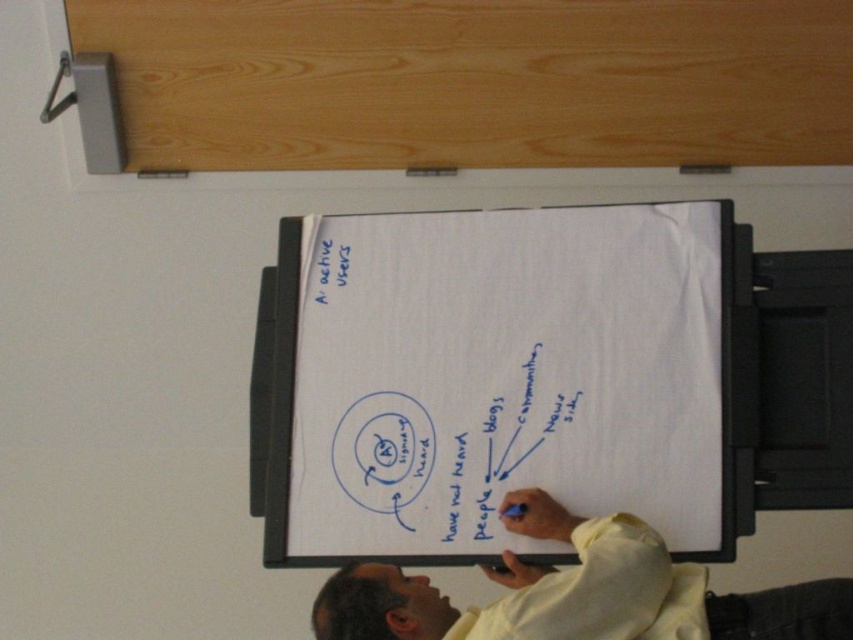
Question: Does white paperboard at center appear under light yellow shirt at center?

Choices:
 (A) no
 (B) yes

Answer: (A)

Question: Which point appears farthest from the camera in this image?

Choices:
 (A) (490, 243)
 (B) (552, 602)

Answer: (A)

Question: From the image, what is the correct spatial relationship of white paperboard at center in relation to light yellow shirt at center?

Choices:
 (A) below
 (B) above

Answer: (B)

Question: Can you confirm if white paperboard at center is positioned above light yellow shirt at center?

Choices:
 (A) yes
 (B) no

Answer: (A)

Question: Which object appears closest to the camera in this image?

Choices:
 (A) light yellow shirt at center
 (B) white paperboard at center

Answer: (A)